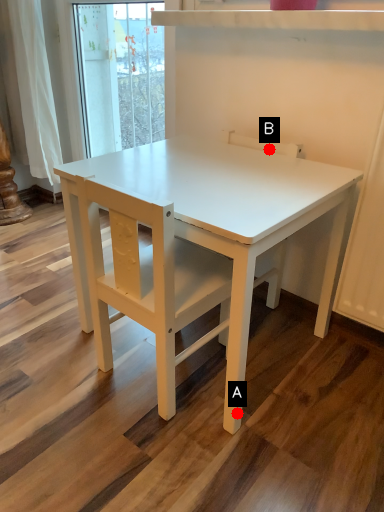
Question: Two points are circled on the image, labeled by A and B beside each circle. Among these points, which one is farthest from the camera?

Choices:
 (A) A is further
 (B) B is further

Answer: (B)